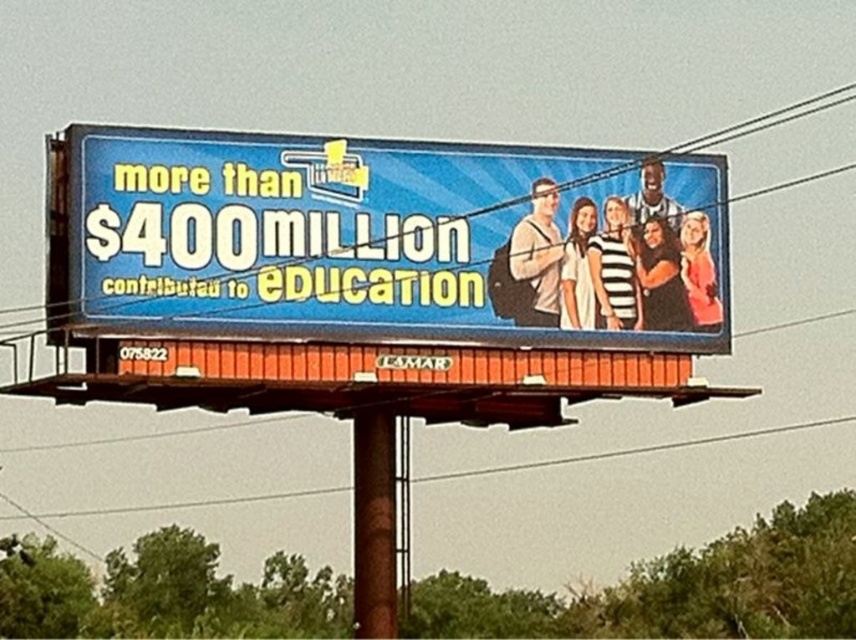
Does point (627, 305) lie behind point (373, 596)?

Yes, point (627, 305) is farther from viewer.

Is blue plastic billboard at upper center positioned behind brown wood pole at center?

No, it is in front of brown wood pole at center.

Identify the location of blue plastic billboard at upper center. The width and height of the screenshot is (856, 640). (381, 237).

Identify the location of blue plastic billboard at upper center. The width and height of the screenshot is (856, 640). click(x=381, y=237).